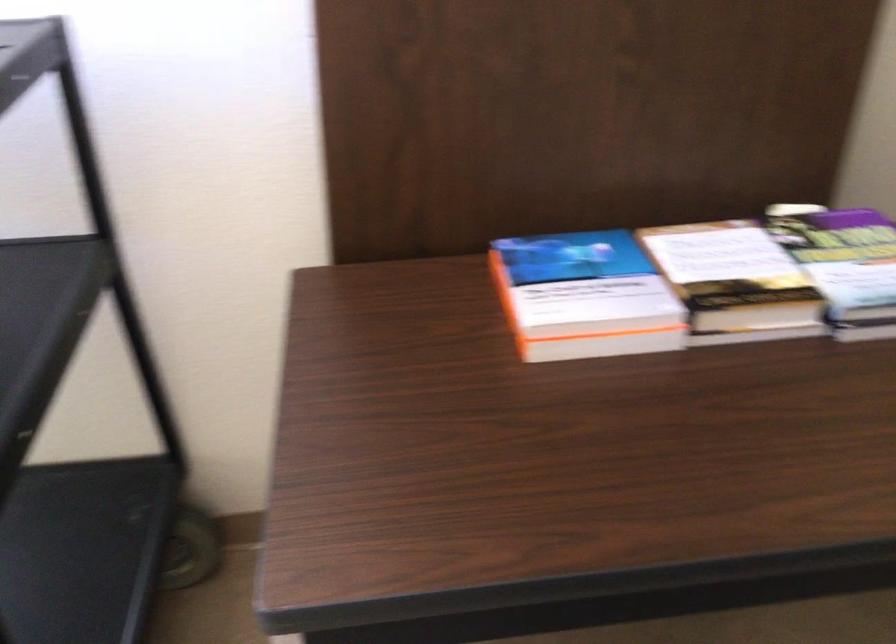
This screenshot has height=644, width=896. What do you see at coordinates (71, 410) in the screenshot?
I see `a black cart frame` at bounding box center [71, 410].